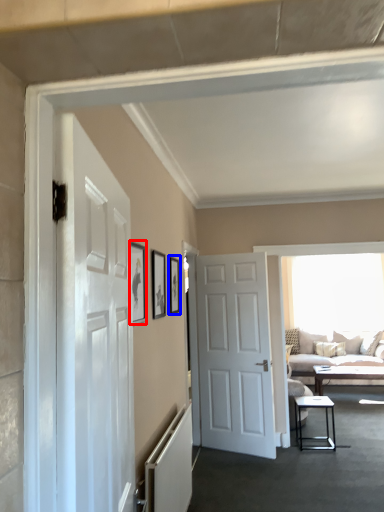
Question: Which of the following is the closest to the observer, picture frame (highlighted by a red box) or picture frame (highlighted by a blue box)?

Choices:
 (A) picture frame
 (B) picture frame

Answer: (A)